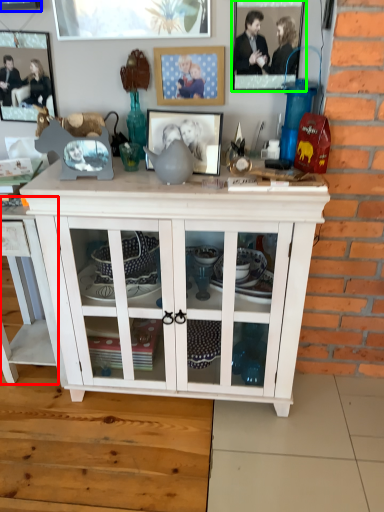
Question: Which is nearer to the table (highlighted by a red box)? picture frame (highlighted by a blue box) or picture frame (highlighted by a green box).

Choices:
 (A) picture frame
 (B) picture frame

Answer: (A)